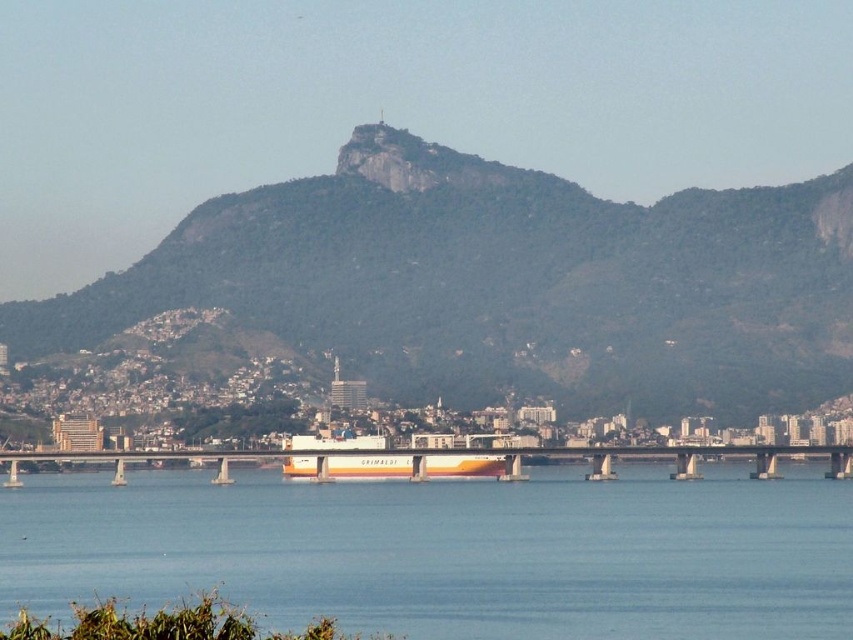
Question: Which object is the closest to the green rocky mountain at upper center?

Choices:
 (A) orange matte container ship at center
 (B) yellow-orange concrete bridge at center
 (C) transparent water at lower center

Answer: (B)

Question: Observing the image, what is the correct spatial positioning of green rocky mountain at upper center in reference to transparent water at lower center?

Choices:
 (A) left
 (B) right

Answer: (B)

Question: Which point appears closest to the camera in this image?

Choices:
 (A) (401, 209)
 (B) (303, 448)
 (C) (834, 444)
 (D) (601, 605)

Answer: (A)

Question: Observing the image, what is the correct spatial positioning of green rocky mountain at upper center in reference to yellow-orange concrete bridge at center?

Choices:
 (A) right
 (B) left

Answer: (B)

Question: Does green rocky mountain at upper center appear over orange matte container ship at center?

Choices:
 (A) yes
 (B) no

Answer: (A)

Question: Which of the following is the farthest from the observer?

Choices:
 (A) (317, 588)
 (B) (376, 458)
 (C) (524, 241)

Answer: (A)